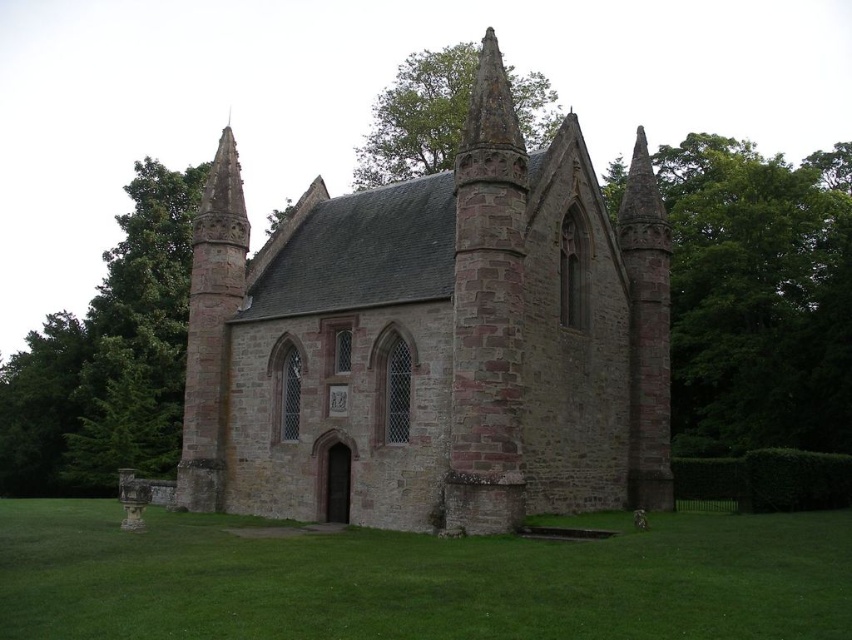
Question: Among these objects, which one is farthest from the camera?

Choices:
 (A) green grass at lower center
 (B) green leafy tree at upper center
 (C) green leafy tree at right

Answer: (C)

Question: Which point appears farthest from the camera in this image?

Choices:
 (A) (672, 396)
 (B) (372, 225)
 (C) (514, 624)

Answer: (A)

Question: Which of the following is the closest to the observer?

Choices:
 (A) (445, 102)
 (B) (568, 445)
 (C) (447, 625)
 (D) (780, 396)

Answer: (C)

Question: Does green grass at lower center have a greater width compared to green leafy tree at upper center?

Choices:
 (A) no
 (B) yes

Answer: (B)

Question: Does brown stone church at center appear on the right side of green leafy tree at upper center?

Choices:
 (A) no
 (B) yes

Answer: (A)

Question: Is green leafy tree at right positioned before green leafy tree at upper center?

Choices:
 (A) no
 (B) yes

Answer: (A)